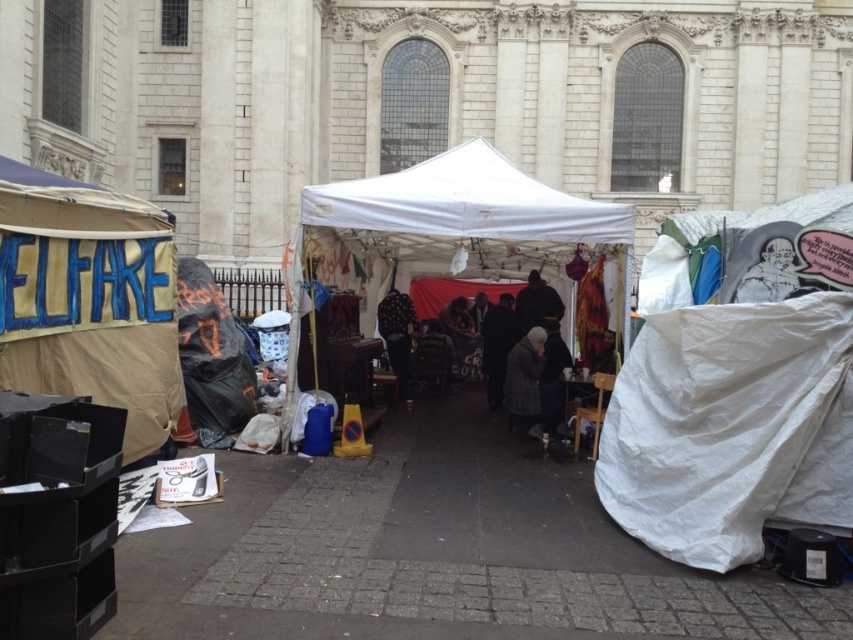
Can you confirm if white fabric canopy at center is positioned to the left of polka dot fabric at center?

No, white fabric canopy at center is not to the left of polka dot fabric at center.

Who is more forward, (573,225) or (405,353)?

Point (573,225) is more forward.

This screenshot has width=853, height=640. I want to click on white fabric canopy at center, so click(x=465, y=202).

Is white fabric tent at center thinner than white fabric canopy at center?

Correct, white fabric tent at center's width is less than white fabric canopy at center's.

Is white fabric tent at center positioned at the back of white fabric canopy at center?

Yes, it is behind white fabric canopy at center.

Between point (416, 170) and point (473, 144), which one is positioned behind?

Point (473, 144)

The width and height of the screenshot is (853, 640). I want to click on white fabric tent at center, so click(456, 218).

This screenshot has height=640, width=853. Identify the location of white tarp at right. (737, 387).

This screenshot has width=853, height=640. Find the location of `white tarp at right`. white tarp at right is located at coordinates (737, 387).